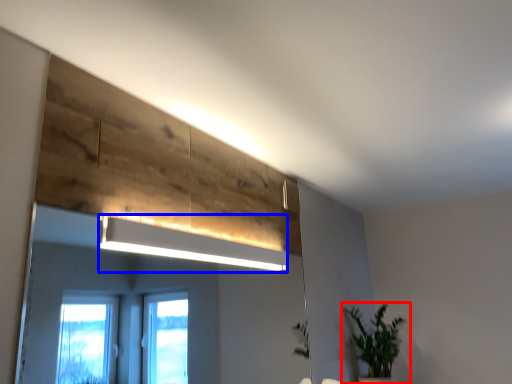
Question: Which object is further to the camera taking this photo, houseplant (highlighted by a red box) or lamp (highlighted by a blue box)?

Choices:
 (A) houseplant
 (B) lamp

Answer: (A)